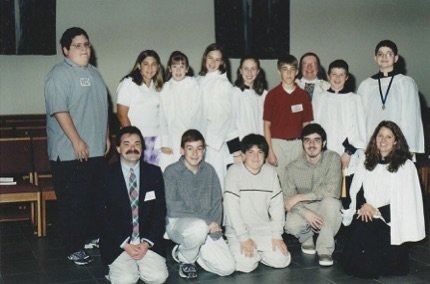
The height and width of the screenshot is (284, 430). I want to click on floor, so click(45, 258).